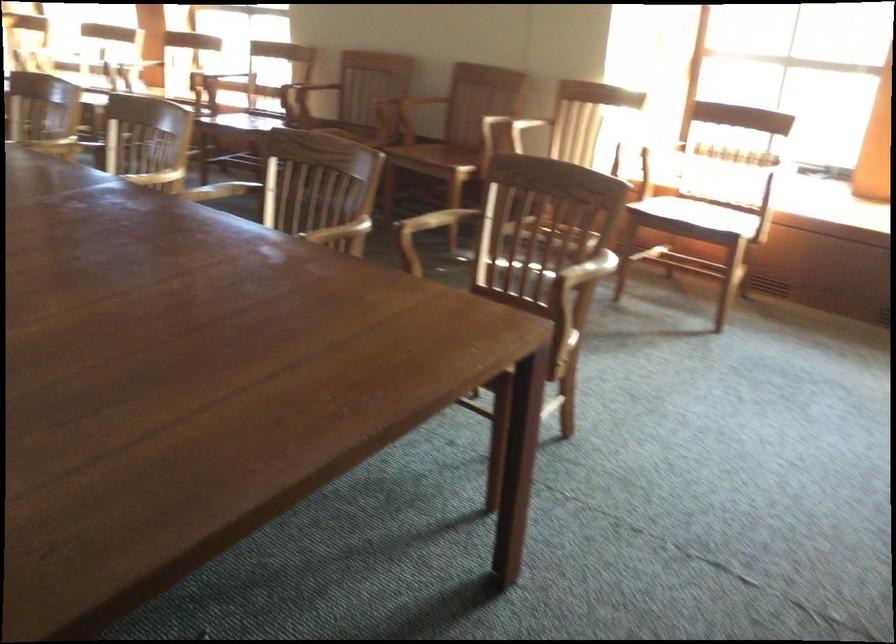
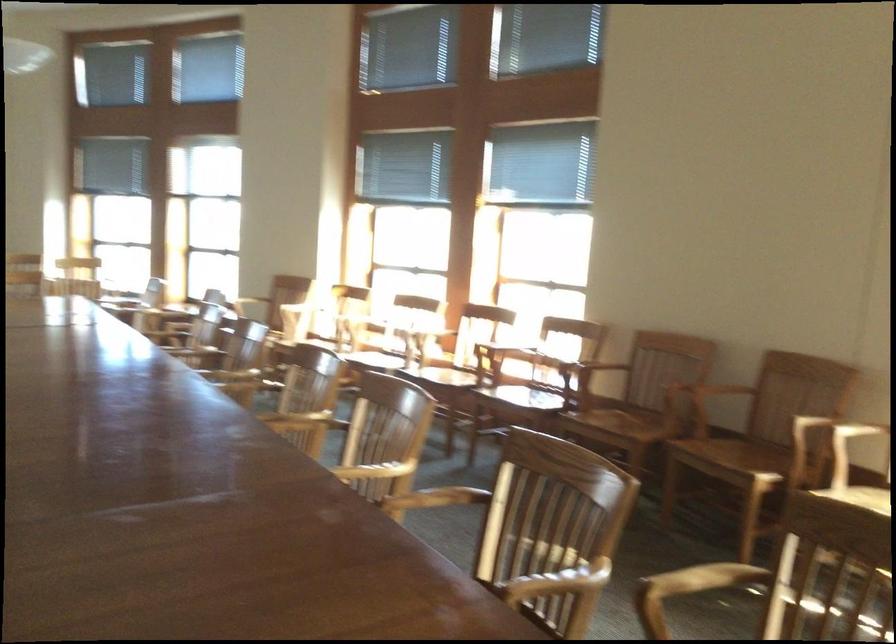
The images are taken continuously from a first-person perspective. In which direction is your viewpoint rotating?

The camera's rotation is toward left-up.